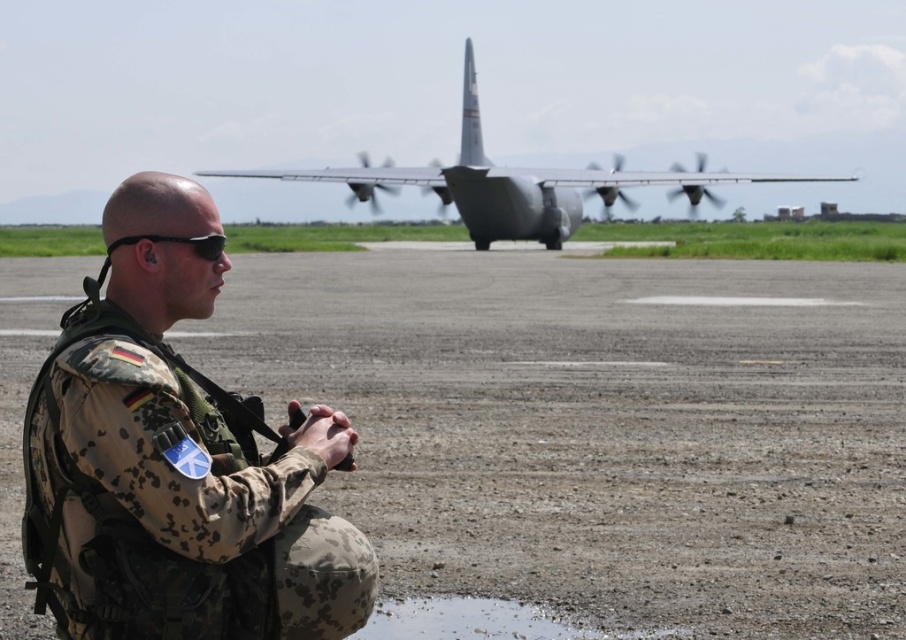
Which is behind, point (677, 262) or point (252, 572)?

Point (677, 262)

Does point (708, 390) lie in front of point (320, 419)?

No, (708, 390) is further to viewer.

I want to click on dull gray tarmac at center, so click(x=600, y=426).

Can you confirm if dull gray tarmac at center is positioned to the left of silver metallic airplane at center?

Yes, dull gray tarmac at center is to the left of silver metallic airplane at center.

Is dull gray tarmac at center positioned at the back of silver metallic airplane at center?

No, it is in front of silver metallic airplane at center.

Who is more distant from viewer, (499,372) or (560,211)?

Positioned behind is point (560,211).

Locate an element on the screen. dull gray tarmac at center is located at coordinates (600, 426).

Does camouflage uniform at left appear over silver metallic airplane at center?

No.

Where is `camouflage uniform at left`? The height and width of the screenshot is (640, 906). camouflage uniform at left is located at coordinates (177, 481).